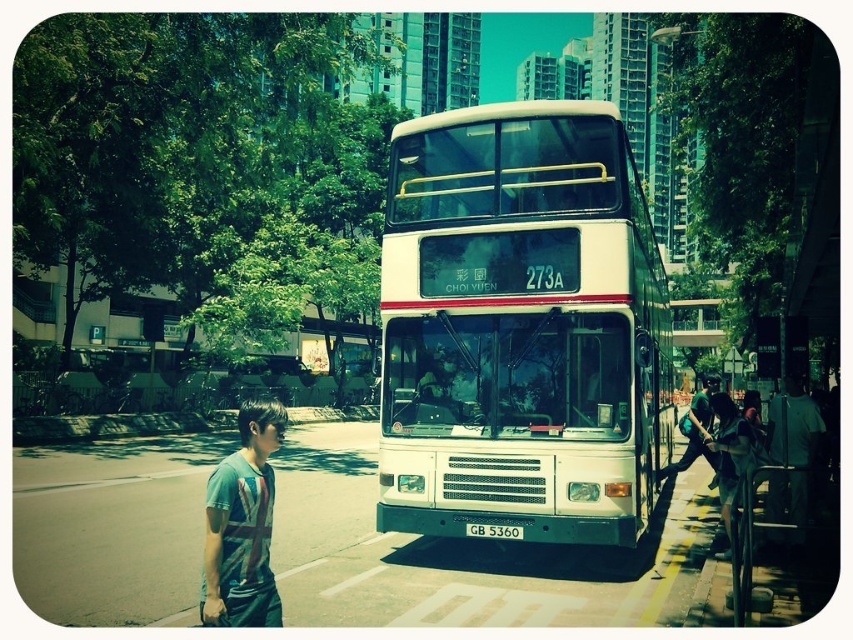
Does white matte double-decker bus at center come in front of black plastic license plate at center?

Yes, white matte double-decker bus at center is closer to the viewer.

Does white matte double-decker bus at center have a smaller size compared to black plastic license plate at center?

Incorrect, white matte double-decker bus at center is not smaller in size than black plastic license plate at center.

Is point (399, 321) closer to viewer compared to point (482, 531)?

No, it is not.

Identify the location of white matte double-decker bus at center. This screenshot has height=640, width=853. (521, 326).

Describe the element at coordinates (791, 451) in the screenshot. I see `white fabric shirt at right` at that location.

The width and height of the screenshot is (853, 640). In order to click on white fabric shirt at right in this screenshot , I will do `click(791, 451)`.

The image size is (853, 640). I want to click on white fabric shirt at right, so click(791, 451).

Locate an element on the screen. The image size is (853, 640). white matte double-decker bus at center is located at coordinates (521, 326).

Who is shorter, white matte double-decker bus at center or printed cotton t-shirt at lower left?

With less height is printed cotton t-shirt at lower left.

Which is in front, point (381, 515) or point (248, 566)?

Point (248, 566) is more forward.

Find the location of a particular element. The image size is (853, 640). white matte double-decker bus at center is located at coordinates (521, 326).